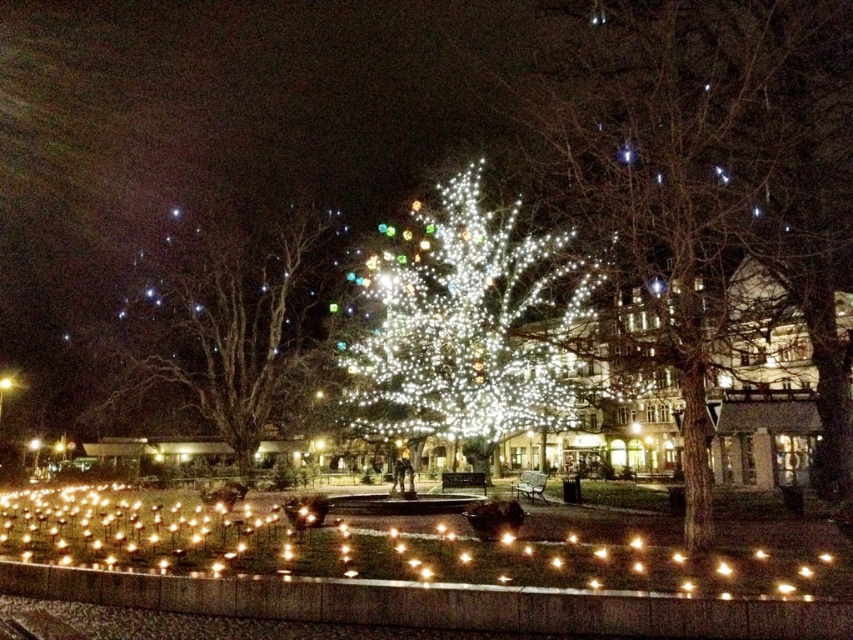
You are standing at the point with coordinates point [466,330] in the image. What object are you directly facing?

You are directly facing the illuminated glass christmas tree at center as indicated by the point [466,330].

You are a photographer trying to capture the illuminated white lights at center and the illuminated wireframe tree at left in the same frame. Which object should you focus on first if you want to ensure both are in focus?

The illuminated white lights at center is taller than the illuminated wireframe tree at left, so you should focus on the illuminated white lights at center first to ensure both are in focus.

In the scene shown: You are standing in the park and want to take a photo of the illuminated white lights at center and the illuminated wireframe tree at left. Which object should you point your camera upwards to capture?

You should point your camera upwards to capture the illuminated white lights at center because it is located above the illuminated wireframe tree at left.